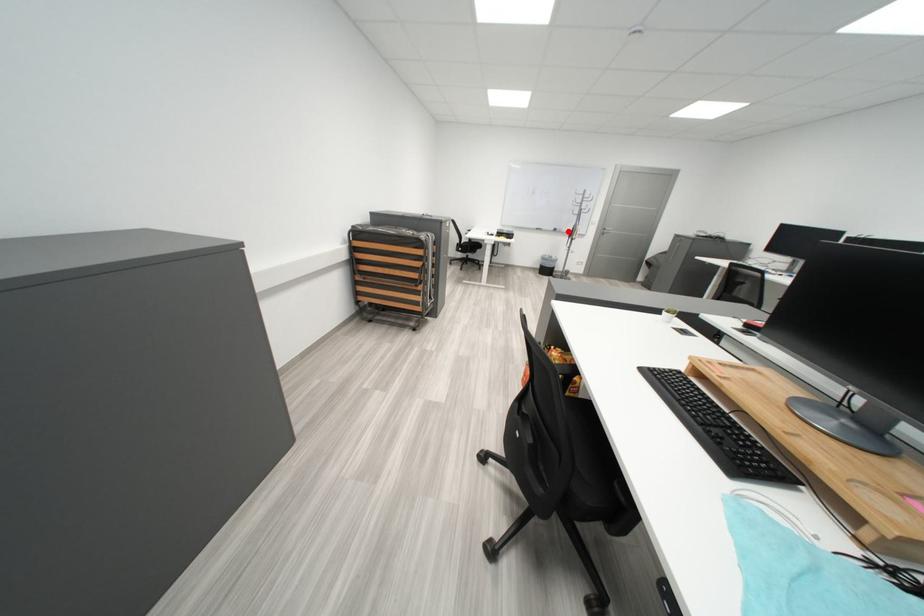
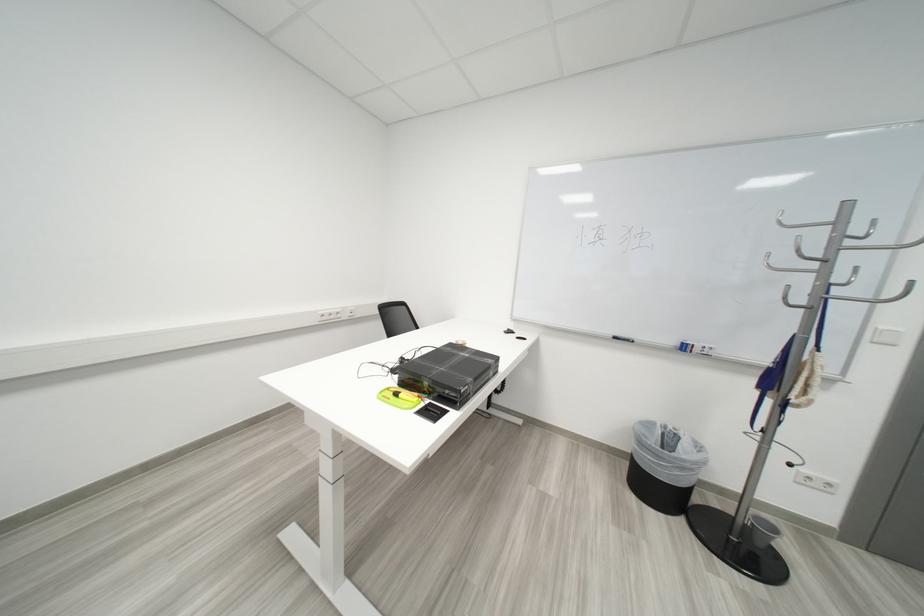
Question: I am providing you with two images of the same scene from different viewpoints. Given a red point in image1, look at the same physical point in image2. Is it:

Choices:
 (A) Closer to the viewpoint
 (B) Farther from the viewpoint

Answer: (B)